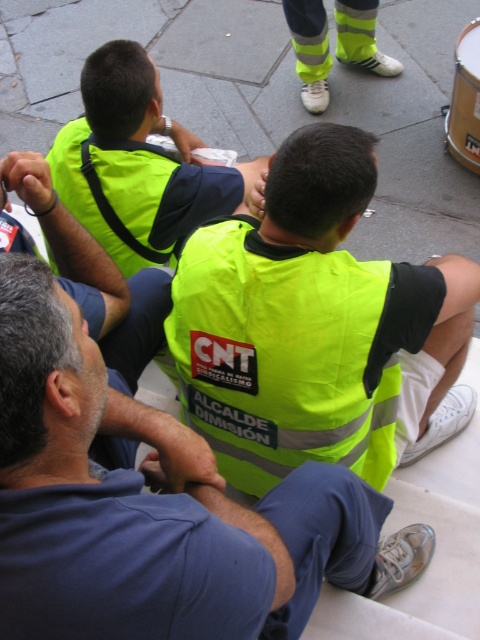
Question: Is high visibility vest at center bigger than neon yellow vest at upper center?

Choices:
 (A) yes
 (B) no

Answer: (A)

Question: Which of the following is the closest to the observer?

Choices:
 (A) high visibility vest at center
 (B) neon yellow vest at upper center

Answer: (A)

Question: Does high visibility vest at center appear on the left side of neon yellow vest at upper center?

Choices:
 (A) no
 (B) yes

Answer: (A)

Question: Does high visibility vest at center appear under neon yellow vest at upper center?

Choices:
 (A) yes
 (B) no

Answer: (A)

Question: Which of these objects is positioned farthest from the neon yellow vest at upper center?

Choices:
 (A) high visibility vest at center
 (B) yellow reflective vest at center

Answer: (A)

Question: Which object appears closest to the camera in this image?

Choices:
 (A) high visibility vest at center
 (B) neon yellow vest at upper center

Answer: (A)